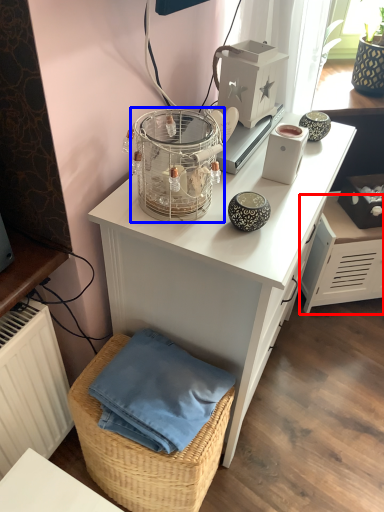
Question: Among these objects, which one is farthest to the camera, file cabinet (highlighted by a red box) or bird cage (highlighted by a blue box)?

Choices:
 (A) file cabinet
 (B) bird cage

Answer: (A)